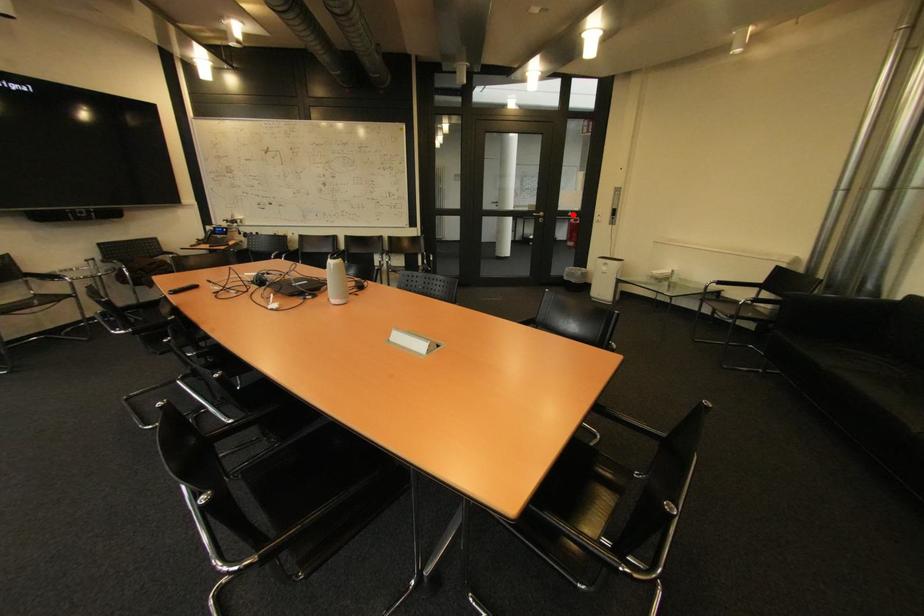
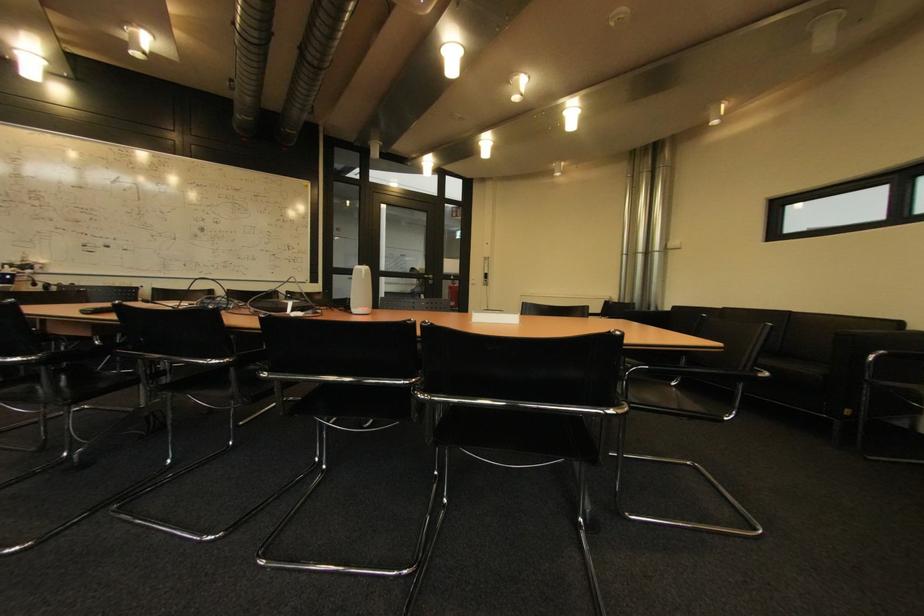
Where in the second image is the point corresponding to the highlighted location from the first image?

(456, 278)